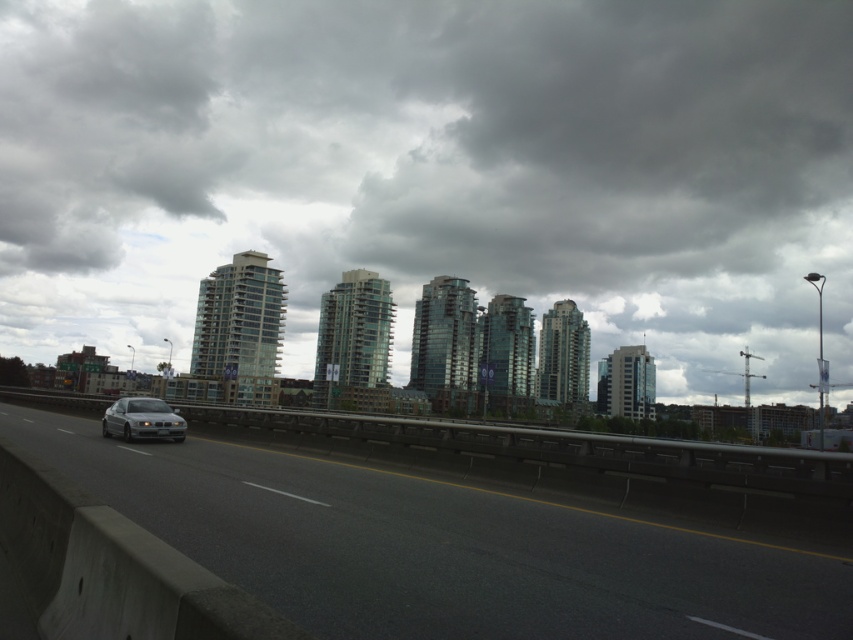
Is gray asphalt highway at center positioned at the back of sleek silver sedan at left?

No, it is in front of sleek silver sedan at left.

Find the location of a particular element. The image size is (853, 640). gray asphalt highway at center is located at coordinates (438, 547).